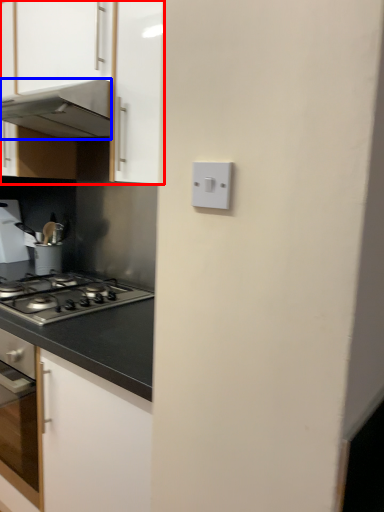
Question: Which point is closer to the camera, cabinetry (highlighted by a red box) or home appliance (highlighted by a blue box)?

Choices:
 (A) cabinetry
 (B) home appliance

Answer: (A)